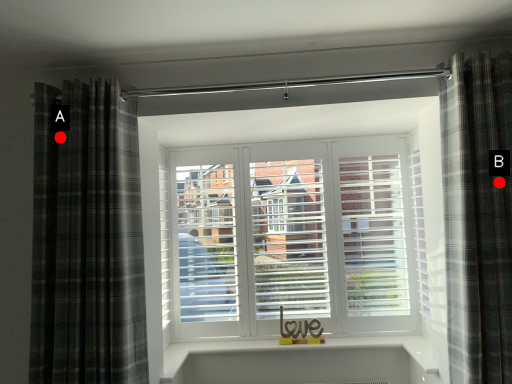
Question: Two points are circled on the image, labeled by A and B beside each circle. Among these points, which one is farthest from the camera?

Choices:
 (A) A is further
 (B) B is further

Answer: (A)